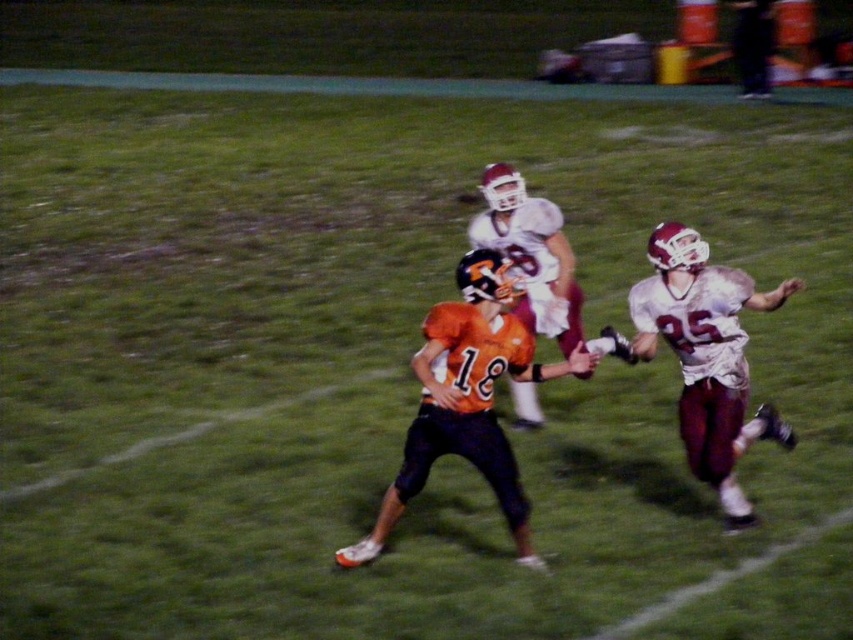
Which of these two, orange jersey at center or white matte jersey at center-right, stands shorter?

With less height is orange jersey at center.

Can you confirm if orange jersey at center is shorter than white matte jersey at center-right?

Correct, orange jersey at center is not as tall as white matte jersey at center-right.

This screenshot has height=640, width=853. Identify the location of orange jersey at center. (467, 400).

Which of these two, white matte jersey at center-right or white matte jersey at center, stands shorter?

white matte jersey at center is shorter.

Can you confirm if white matte jersey at center-right is positioned above white matte jersey at center?

Incorrect, white matte jersey at center-right is not positioned above white matte jersey at center.

Locate an element on the screen. The image size is (853, 640). white matte jersey at center-right is located at coordinates (706, 355).

Can you confirm if orange jersey at center is positioned below white matte jersey at center?

Correct, orange jersey at center is located below white matte jersey at center.

Is point (514, 476) farther from camera compared to point (523, 220)?

That is False.

Locate an element on the screen. The height and width of the screenshot is (640, 853). orange jersey at center is located at coordinates (467, 400).